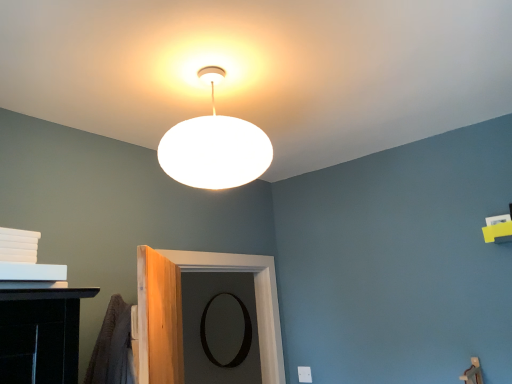
What are the coordinates of `black matte mirror at center` in the screenshot? It's located at (243, 337).

Find the location of a particular element. Image resolution: width=512 pixels, height=384 pixels. black matte door at center is located at coordinates (181, 310).

Is black matte mirror at center beside black matte door at center?

black matte mirror at center and black matte door at center are not in contact.

Between black matte mirror at center and black matte door at center, which one appears on the left side from the viewer's perspective?

black matte mirror at center is more to the left.

In terms of width, does black matte mirror at center look wider or thinner when compared to black matte door at center?

In the image, black matte mirror at center appears to be more narrow than black matte door at center.

From the image's perspective, between black matte mirror at center and black matte door at center, who is located below?

black matte mirror at center appears lower in the image.

From a real-world perspective, does black matte door at center stand above black matte mirror at center?

Yes, from a real-world perspective, black matte door at center is on top of black matte mirror at center.

Is black matte mirror at center completely or partially inside black matte door at center?

No, black matte mirror at center is not a part of black matte door at center.

Does black matte door at center have a lesser width compared to black matte mirror at center?

In fact, black matte door at center might be wider than black matte mirror at center.

Can you confirm if black matte door at center is positioned to the left of black matte mirror at center?

No.

From the image's perspective, is white matte lampshade at upper center over black matte door at center?

Yes, from the image's perspective, white matte lampshade at upper center is above black matte door at center.

Which of these two, white matte lampshade at upper center or black matte door at center, is wider?

Wider between the two is white matte lampshade at upper center.

Is white matte lampshade at upper center looking in the opposite direction of black matte door at center?

No, black matte door at center is not at the back of white matte lampshade at upper center.

Consider the image. Does white matte lampshade at upper center have a greater height compared to black matte door at center?

No, white matte lampshade at upper center is not taller than black matte door at center.

Is black matte mirror at center looking in the opposite direction of white matte lampshade at upper center?

That's not correct — black matte mirror at center is not looking away from white matte lampshade at upper center.

From a real-world perspective, which is physically below, black matte mirror at center or white matte lampshade at upper center?

From a 3D spatial view, black matte mirror at center is below.

From the image's perspective, is black matte mirror at center on top of white matte lampshade at upper center?

No.

Between white matte lampshade at upper center and black matte mirror at center, which one appears on the right side from the viewer's perspective?

From the viewer's perspective, white matte lampshade at upper center appears more on the right side.

Is white matte lampshade at upper center positioned beyond the bounds of black matte mirror at center?

Absolutely, white matte lampshade at upper center is external to black matte mirror at center.

Who is shorter, white matte lampshade at upper center or black matte mirror at center?

With less height is white matte lampshade at upper center.

Considering the relative sizes of black matte door at center and white matte lampshade at upper center in the image provided, is black matte door at center bigger than white matte lampshade at upper center?

Yes, black matte door at center is bigger than white matte lampshade at upper center.

Would you say black matte door at center contains white matte lampshade at upper center?

No, black matte door at center does not contain white matte lampshade at upper center.

In terms of height, does black matte door at center look taller or shorter compared to white matte lampshade at upper center?

black matte door at center is taller than white matte lampshade at upper center.

Looking at this image, from a real-world perspective, relative to white matte lampshade at upper center, is black matte door at center vertically above or below?

Clearly, from a real-world perspective, black matte door at center is below white matte lampshade at upper center.

Where is `door above the black matte mirror at center (from a real-world perspective)`? The image size is (512, 384). door above the black matte mirror at center (from a real-world perspective) is located at coordinates (181, 310).

Locate an element on the screen. door in front of the black matte mirror at center is located at coordinates (181, 310).

Which object lies further to the anchor point white matte lampshade at upper center, black matte door at center or black matte mirror at center?

black matte mirror at center lies further to white matte lampshade at upper center than the other object.

When comparing their distances from black matte door at center, does black matte mirror at center or white matte lampshade at upper center seem further?

black matte mirror at center is positioned further to the anchor black matte door at center.

From the image, which object appears to be nearer to black matte mirror at center, white matte lampshade at upper center or black matte door at center?

Among the two, black matte door at center is located nearer to black matte mirror at center.

Based on their spatial positions, is black matte door at center or white matte lampshade at upper center closer to black matte mirror at center?

Among the two, black matte door at center is located nearer to black matte mirror at center.

Considering their positions, is white matte lampshade at upper center positioned further to black matte door at center than black matte mirror at center?

black matte mirror at center.

When comparing their distances from white matte lampshade at upper center, does black matte mirror at center or black matte door at center seem further?

Based on the image, black matte mirror at center appears to be further to white matte lampshade at upper center.

Locate an element on the screen. The width and height of the screenshot is (512, 384). door between white matte lampshade at upper center and black matte mirror at center along the z-axis is located at coordinates (181, 310).